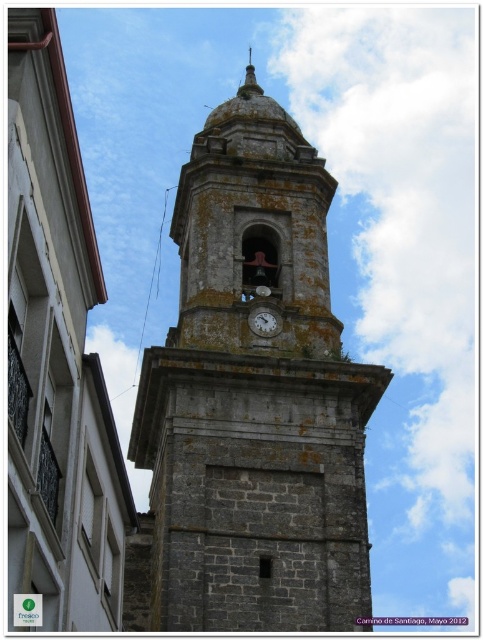
Question: Estimate the real-world distances between objects in this image. Which object is closer to the gold textured spire at upper center?

Choices:
 (A) matte gray clock at center
 (B) gray stone clock tower at center

Answer: (B)

Question: Can you confirm if gray stone clock tower at center is bigger than gold textured spire at upper center?

Choices:
 (A) no
 (B) yes

Answer: (B)

Question: Is gray stone clock tower at center smaller than matte gray clock at center?

Choices:
 (A) no
 (B) yes

Answer: (A)

Question: Is gray stone clock tower at center to the right of gold textured spire at upper center from the viewer's perspective?

Choices:
 (A) no
 (B) yes

Answer: (A)

Question: Considering the real-world distances, which object is closest to the matte gray clock at center?

Choices:
 (A) gold textured spire at upper center
 (B) gray stone clock tower at center

Answer: (B)

Question: Which point appears closest to the camera in this image?

Choices:
 (A) (265, 316)
 (B) (359, 515)

Answer: (B)